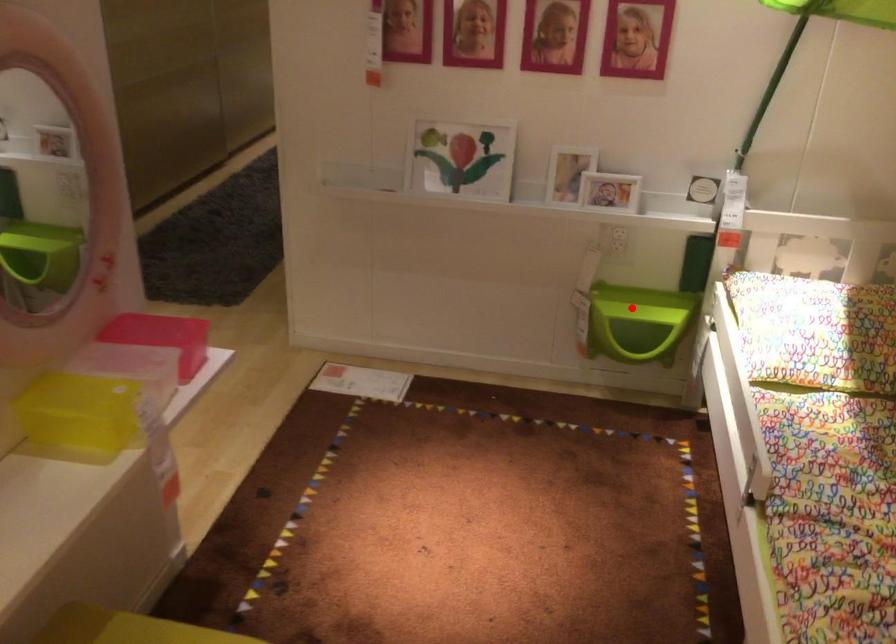
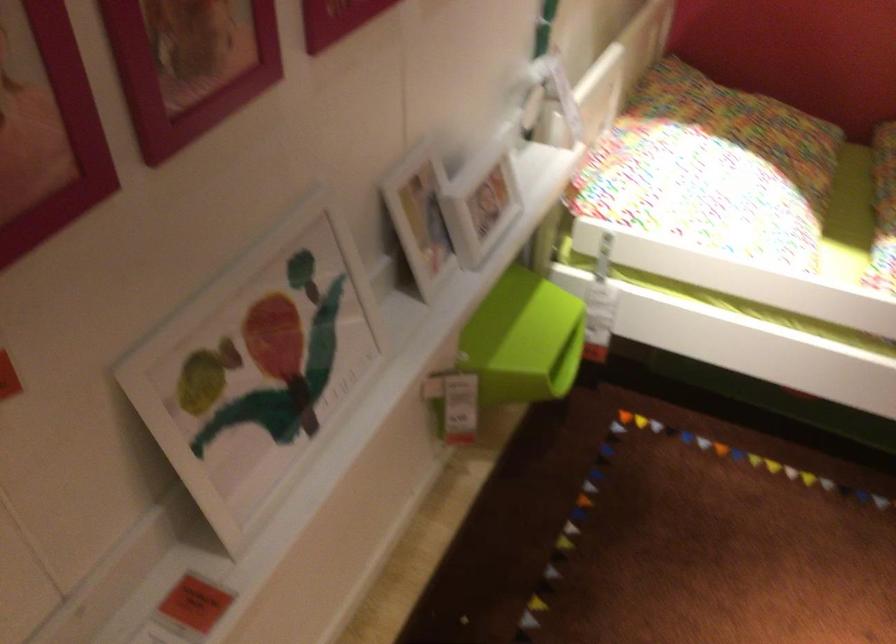
Locate, in the second image, the point that corresponds to the highlighted location in the first image.

(522, 339)